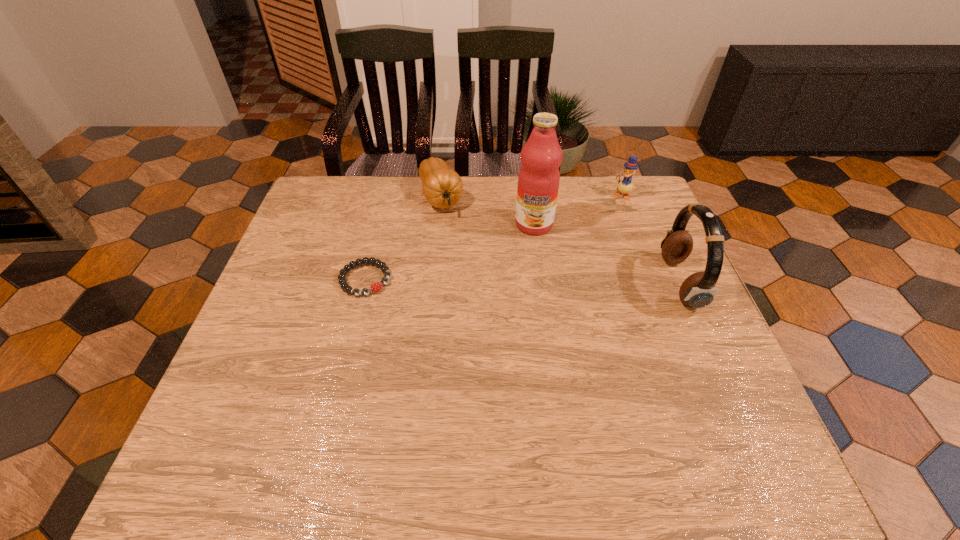
This screenshot has height=540, width=960. In order to click on free space between the leftmost object and the headset in this screenshot , I will do `click(522, 281)`.

You are a GUI agent. You are given a task and a screenshot of the screen. Output one action in this format:
    pyautogui.click(x=<x>, y=<y>)
    Task: Click on the free point between the bracelet and the headset
    The width and height of the screenshot is (960, 540).
    Given the screenshot: What is the action you would take?
    pyautogui.click(x=522, y=281)

Find the location of `empty space between the bracelet and the second object from left to right`. empty space between the bracelet and the second object from left to right is located at coordinates (403, 238).

Identify the location of empty space between the duckling and the tallest object. This screenshot has width=960, height=540. (578, 210).

Where is `empty location between the fruit juice and the duckling`? empty location between the fruit juice and the duckling is located at coordinates tap(578, 210).

Find the location of `free space between the fourth shortest object and the shortest object`. free space between the fourth shortest object and the shortest object is located at coordinates (522, 281).

Image resolution: width=960 pixels, height=540 pixels. In order to click on vacant point located between the fourth shortest object and the bracelet in this screenshot , I will do `click(522, 281)`.

Where is `free spot between the duckling and the second tallest object`? free spot between the duckling and the second tallest object is located at coordinates (651, 239).

Locate an element on the screen. object identified as the closest to the duckling is located at coordinates (538, 181).

Locate which object is the fourth closest to the leftmost object. Please provide its 2D coordinates. Your answer should be formatted as a tuple, i.e. [(x, y)], where the tuple contains the x and y coordinates of a point satisfying the conditions above.

[(625, 186)]